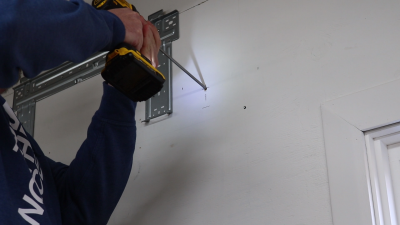
The height and width of the screenshot is (225, 400). Find the location of `wall`. wall is located at coordinates (315, 46), (58, 116), (232, 191).